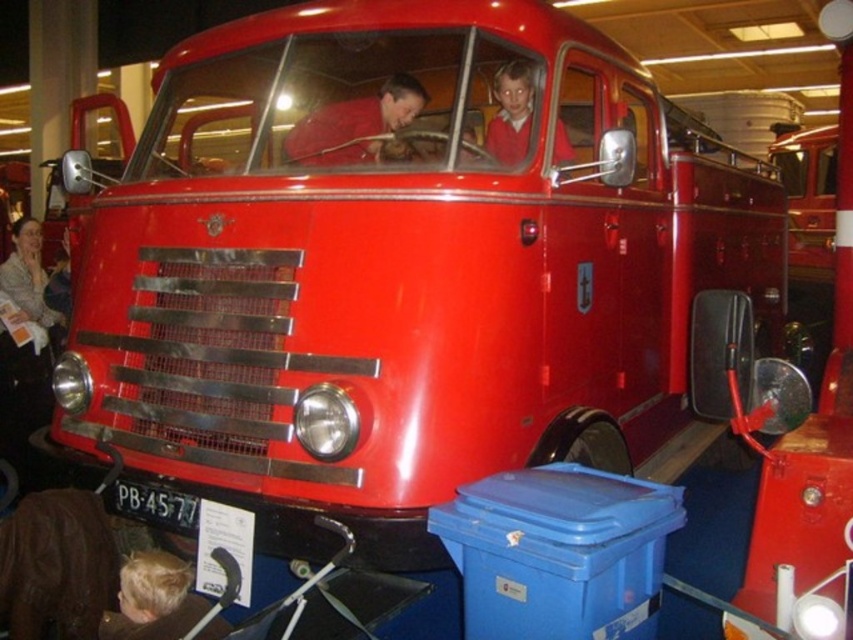
Question: Is blonde hair at lower left positioned in front of smooth red shirt at upper center?

Choices:
 (A) no
 (B) yes

Answer: (B)

Question: Among these objects, which one is farthest from the camera?

Choices:
 (A) blonde hair at lower left
 (B) glossy red fire truck at center
 (C) smooth red shirt at upper center

Answer: (B)

Question: Which point is closer to the camera?

Choices:
 (A) (322, 109)
 (B) (517, 115)

Answer: (B)

Question: Where is blonde hair at lower left located in relation to smooth red shirt at upper center in the image?

Choices:
 (A) left
 (B) right

Answer: (A)

Question: Which object is farther from the camera taking this photo?

Choices:
 (A) blonde hair at lower left
 (B) smooth red shirt at upper center
 (C) matte red shirt at center
 (D) glossy red fire truck at center

Answer: (D)

Question: From the image, what is the correct spatial relationship of matte red shirt at center in relation to smooth red shirt at upper center?

Choices:
 (A) below
 (B) above

Answer: (B)